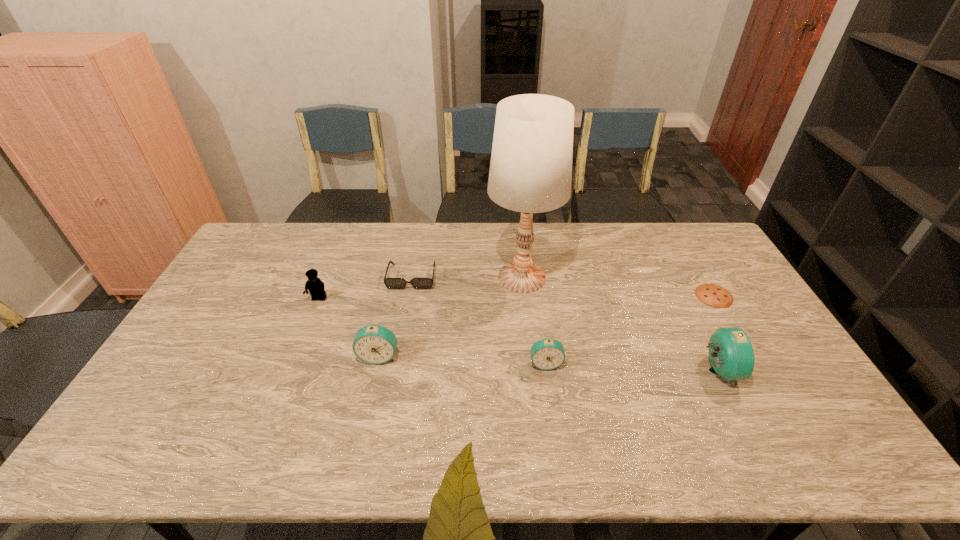
Find the location of a particular element. This screenshot has height=540, width=960. the leftmost alarm clock is located at coordinates (375, 344).

At what (x,y) coordinates should I click in order to perform the action: click on the fifth tallest object. Please return your answer as a coordinate pair (x, y). Image resolution: width=960 pixels, height=540 pixels. Looking at the image, I should click on click(546, 354).

You are a GUI agent. You are given a task and a screenshot of the screen. Output one action in this format:
    pyautogui.click(x=<x>, y=<y>)
    Task: Click on the shortest alarm clock
    The image size is (960, 540).
    Given the screenshot: What is the action you would take?
    pyautogui.click(x=546, y=354)

Locate an element on the screen. The width and height of the screenshot is (960, 540). the sixth shortest object is located at coordinates (731, 354).

The height and width of the screenshot is (540, 960). What are the coordinates of `the sixth object from left to right` in the screenshot? It's located at pos(731,354).

At what (x,y) coordinates should I click in order to perform the action: click on sunglasses. Please return your answer as a coordinate pair (x, y). Looking at the image, I should click on (391, 283).

At what (x,y) coordinates should I click in order to perform the action: click on the tallest object. Please return your answer as a coordinate pair (x, y). Looking at the image, I should click on (530, 172).

The image size is (960, 540). What are the coordinates of `the leftmost object` in the screenshot? It's located at (315, 286).

Locate an element on the screen. The image size is (960, 540). cookie is located at coordinates (713, 295).

Identify the location of the shortest object. This screenshot has height=540, width=960. (713, 295).